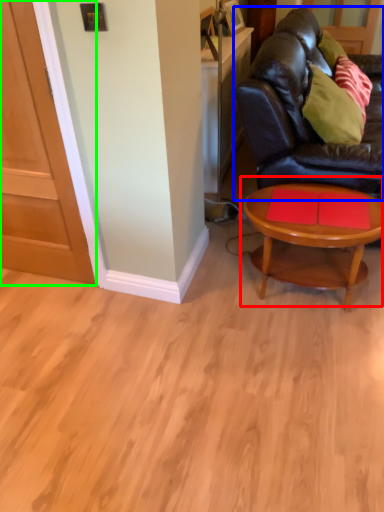
Question: Which is nearer to the coffee table (highlighted by a red box)? studio couch (highlighted by a blue box) or door (highlighted by a green box).

Choices:
 (A) studio couch
 (B) door

Answer: (A)